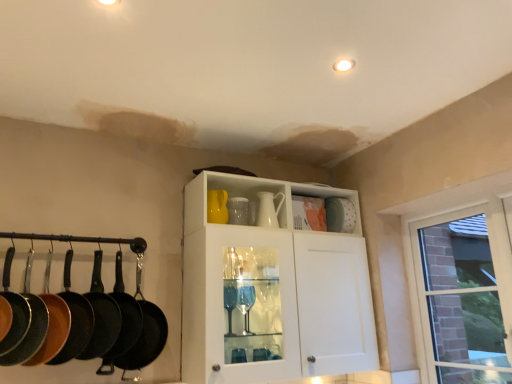
Question: Looking at their shapes, would you say white glossy tea pot at center, which is counted as the 2th tea pot, starting from the left, is wider or thinner than white matte platter at upper right?

Choices:
 (A) thin
 (B) wide

Answer: (A)

Question: Is white glossy tea pot at center, which is counted as the 2th tea pot, starting from the left, inside or outside of white matte platter at upper right?

Choices:
 (A) outside
 (B) inside

Answer: (A)

Question: Based on their relative distances, which object is farther from the black cast iron frying pan at left, acting as the 5th frying pan starting from the left?

Choices:
 (A) matte black frying pan at left, which is the 6th frying pan from right to left
 (B) white glossy cabinet at center
 (C) black non-stick frying pan at left, which is the 5th frying pan from right to left
 (D) black cast iron frying pan at left, the 4th frying pan viewed from the right
 (E) white matte platter at upper right

Answer: (E)

Question: Which of these objects is positioned farthest from the matte yellow tea pot at upper center, the 2th tea pot positioned from the right?

Choices:
 (A) black non-stick frying pan at left, which is the 5th frying pan from right to left
 (B) white glossy cabinet at center
 (C) black cast iron frying pan at left, which ranks as the 1th frying pan in right-to-left order
 (D) black cast iron frying pan at left, which is the third frying pan from right to left
 (E) matte black frying pan at left, the first frying pan viewed from the left

Answer: (E)